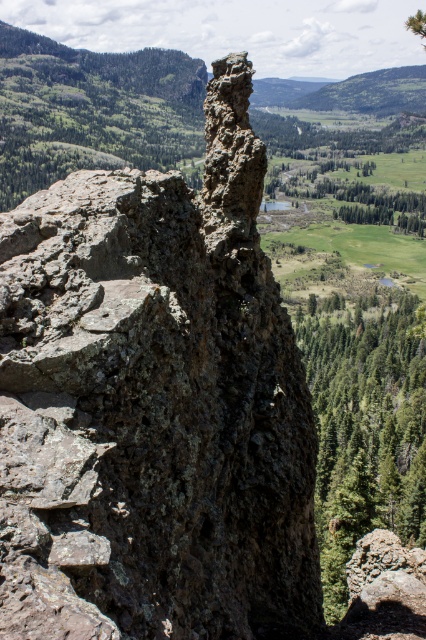
You are planning to place a small garden statue that is 1 meter wide between the rusty stone rock at center and the green textured tree at right. Based on the scene, will the statue fit between them?

The rusty stone rock at center is narrower than the green textured tree at right. However, the exact distance between them isn not specified in the description. Therefore, it is uncertain if the statue will fit without more information about the spacing between the two objects.

You are standing at the point marked as point (154, 404) in the image. What object is located exactly at that point?

The point (154, 404) is exactly where the rusty stone rock at center is located.

You are a hiker trying to determine the tallest object between the rusty stone rock at center and the green textured tree at right. Based on the scene, which one is taller?

The rusty stone rock at center has a lesser height compared to the green textured tree at right, so the green textured tree at right is taller.